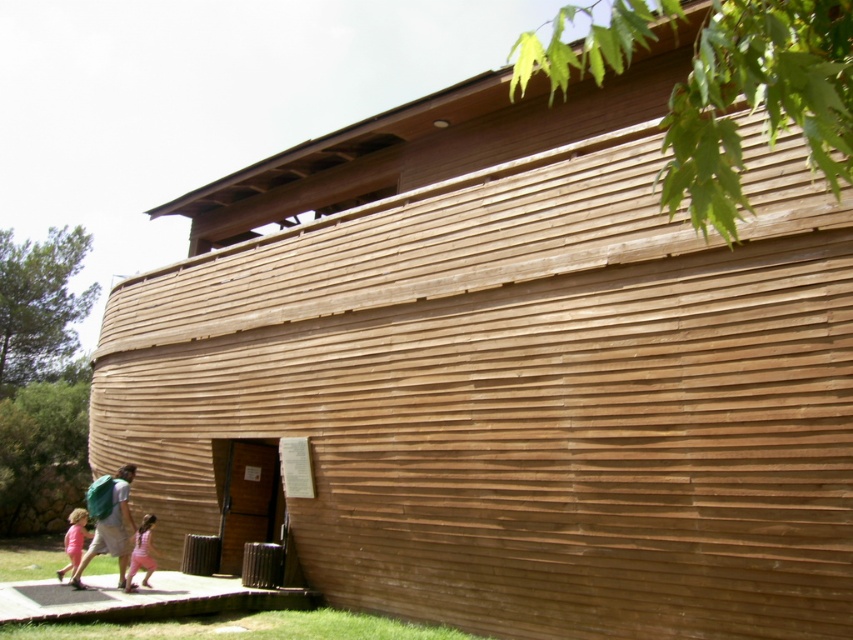
Does matte brown backpack at lower left have a greater width compared to pink fabric dress at lower left?

Incorrect, matte brown backpack at lower left's width does not surpass pink fabric dress at lower left's.

Where is `matte brown backpack at lower left`? Image resolution: width=853 pixels, height=640 pixels. matte brown backpack at lower left is located at coordinates (112, 529).

Find the location of a particular element. matte brown backpack at lower left is located at coordinates (112, 529).

Does matte brown backpack at lower left appear on the left side of pink fabric dress at lower center?

Indeed, matte brown backpack at lower left is positioned on the left side of pink fabric dress at lower center.

Can you confirm if matte brown backpack at lower left is taller than pink fabric dress at lower center?

Yes.

Does point (132, 529) come behind point (149, 520)?

No.

The height and width of the screenshot is (640, 853). I want to click on matte brown backpack at lower left, so click(x=112, y=529).

Is pink fabric dress at lower center taller than pink fabric dress at lower left?

In fact, pink fabric dress at lower center may be shorter than pink fabric dress at lower left.

Is point (141, 529) less distant than point (86, 534)?

That is True.

Locate an element on the screen. pink fabric dress at lower center is located at coordinates (x=141, y=554).